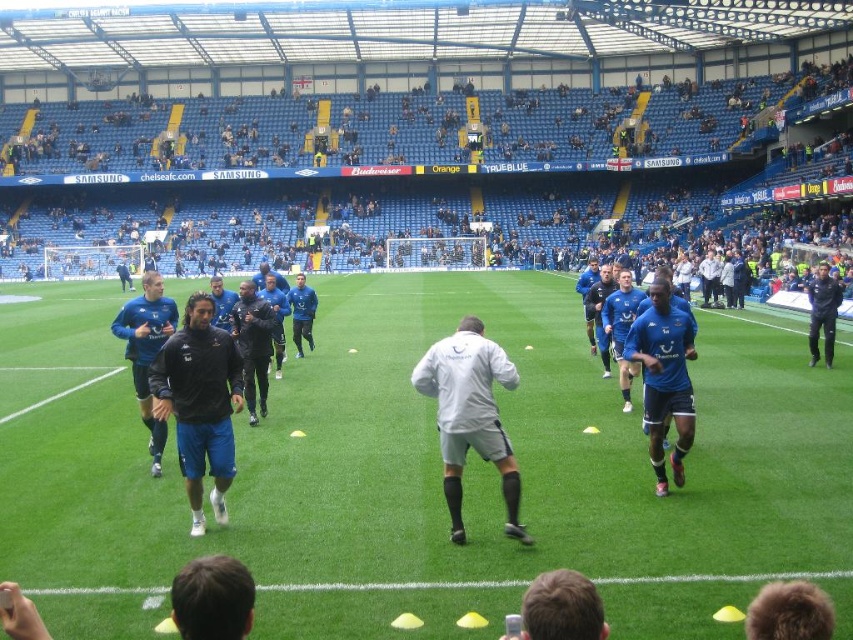
Question: Considering the relative positions of blue jersey at center and dark blue jersey at center in the image provided, where is blue jersey at center located with respect to dark blue jersey at center?

Choices:
 (A) right
 (B) left

Answer: (B)

Question: Among these points, which one is nearest to the camera?

Choices:
 (A) (225, 406)
 (B) (680, 627)
 (C) (834, 296)

Answer: (B)

Question: Is green grass field at center smaller than dark blue jersey at center?

Choices:
 (A) no
 (B) yes

Answer: (A)

Question: Which object appears farthest from the camera in this image?

Choices:
 (A) black matte jacket at center
 (B) blue jersey at center
 (C) dark blue jersey at center

Answer: (C)

Question: Which point is farther to the camera?

Choices:
 (A) (827, 314)
 (B) (407, 445)

Answer: (A)

Question: Does white matte jacket at center have a larger size compared to dark blue jersey at center?

Choices:
 (A) no
 (B) yes

Answer: (A)